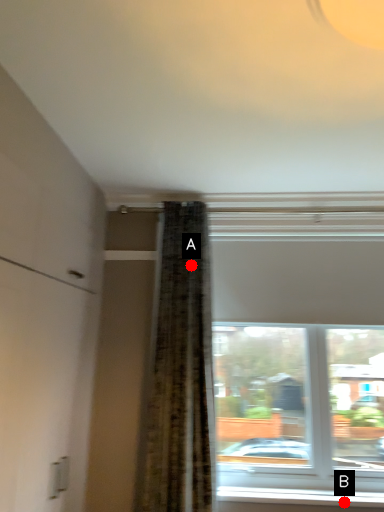
Question: Two points are circled on the image, labeled by A and B beside each circle. Among these points, which one is farthest from the camera?

Choices:
 (A) A is further
 (B) B is further

Answer: (A)